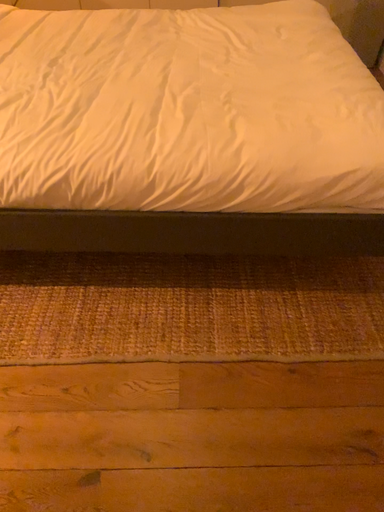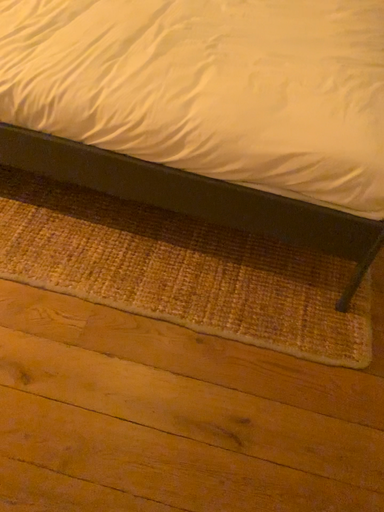
Question: How did the camera likely rotate when shooting the video?

Choices:
 (A) rotated downward
 (B) rotated upward

Answer: (A)